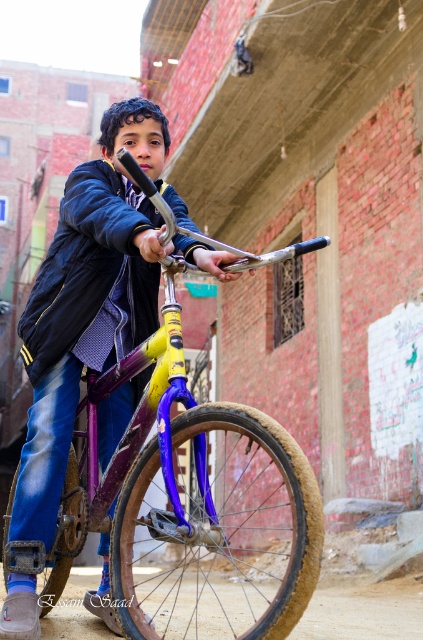
The scene shows a young boy in an alleyway. He is wearing a navy blue fabric jacket at center and holding the handlebars of a yellow matte bicycle at center. From the boy standing at center, which object is positioned to the right?

The yellow matte bicycle at center is to the right of the navy blue fabric jacket at center, so the bicycle is positioned to the right of the boy.

You are a drone operator trying to navigate between two points in the alleyway. The first point is at coordinate point(307, 570) and the second point is at coordinate point(129, 250). Which point is closer to you?

Point(307, 570) is closer to the viewer than point(129, 250).

You are a delivery person who needs to navigate through the narrow alleyway between the brick buildings. There is a yellow matte bicycle at center represented by point [148,442]. Can you safely pass around the bicycle without touching it?

The yellow matte bicycle at center is represented by point [148,442]. Since the alleyway is narrow, you need to carefully maneuver around the bicycle to avoid touching it. The exact path depends on the bicycle position, but maintaining a safe distance should be possible.